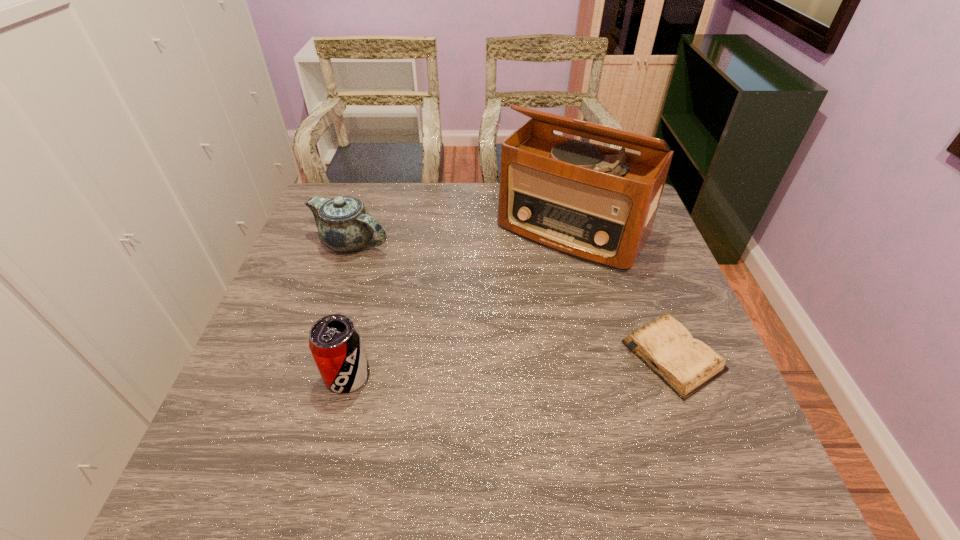
Where is `free region at the near edge of the desktop`? free region at the near edge of the desktop is located at coordinates (329, 424).

At what (x,y) coordinates should I click in order to perform the action: click on free space between the chinaware and the soda can. Please return your answer as a coordinate pair (x, y). Looking at the image, I should click on (349, 309).

Locate an element on the screen. Image resolution: width=960 pixels, height=540 pixels. vacant area between the shortest object and the tallest object is located at coordinates (623, 293).

Find the location of `vacant space that's between the shortest object and the soda can`. vacant space that's between the shortest object and the soda can is located at coordinates (511, 366).

Image resolution: width=960 pixels, height=540 pixels. What are the coordinates of `vacant area between the chinaware and the radio receiver` in the screenshot? It's located at (462, 236).

Find the location of a particular element. This screenshot has height=540, width=960. vacant area that lies between the diary and the soda can is located at coordinates point(511,366).

Locate an element on the screen. The height and width of the screenshot is (540, 960). vacant space that's between the radio receiver and the chinaware is located at coordinates (462, 236).

The image size is (960, 540). Identify the location of free space between the soda can and the tallest object. (x=460, y=303).

This screenshot has width=960, height=540. What are the coordinates of `empty location between the shortest object and the chinaware` in the screenshot? It's located at (513, 300).

You are a GUI agent. You are given a task and a screenshot of the screen. Output one action in this format:
    pyautogui.click(x=<x>, y=<y>)
    Task: Click on the vacant space that's between the radio receiver and the shortest object
    This screenshot has height=540, width=960.
    Given the screenshot: What is the action you would take?
    pyautogui.click(x=623, y=293)